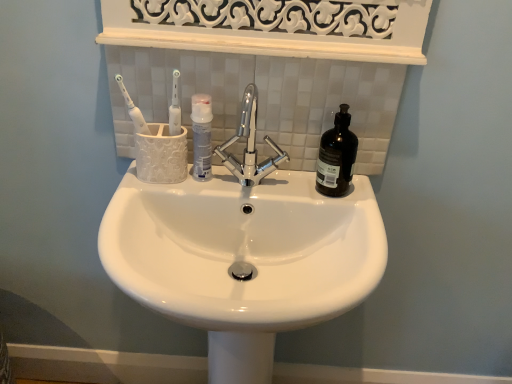
What do you see at coordinates (133, 109) in the screenshot? I see `white glossy toothbrush at upper left` at bounding box center [133, 109].

The width and height of the screenshot is (512, 384). What do you see at coordinates (336, 156) in the screenshot?
I see `black glass bottle at right, arranged as the second mouthwash when viewed from the left` at bounding box center [336, 156].

What is the approximate width of black glass bottle at right, arranged as the second mouthwash when viewed from the left?

9.55 centimeters.

What do you see at coordinates (202, 136) in the screenshot? Image resolution: width=512 pixels, height=384 pixels. I see `white matte mouthwash at center, which is the first mouthwash in left-to-right order` at bounding box center [202, 136].

The image size is (512, 384). In order to click on chrome metallic faucet at center in this screenshot , I will do `click(250, 145)`.

The image size is (512, 384). I want to click on white glossy toothbrush at upper left, so click(x=133, y=109).

Is white matte mouthwash at center, which is the first mouthwash in left-to-right order, positioned far away from white glossy toothbrush at upper left?

No, white matte mouthwash at center, which is the first mouthwash in left-to-right order, is not far from white glossy toothbrush at upper left.

Is white matte mouthwash at center, acting as the 2th mouthwash starting from the right, facing towards white glossy toothbrush at upper left?

No, white matte mouthwash at center, acting as the 2th mouthwash starting from the right, is not oriented towards white glossy toothbrush at upper left.

How many degrees apart are the facing directions of white matte mouthwash at center, acting as the 2th mouthwash starting from the right, and white glossy toothbrush at upper left?

white matte mouthwash at center, acting as the 2th mouthwash starting from the right, and white glossy toothbrush at upper left are facing 12 degrees away from each other.

Visually, is white matte mouthwash at center, which is the first mouthwash in left-to-right order, positioned to the left or to the right of white glossy toothbrush at upper left?

From the image, it's evident that white matte mouthwash at center, which is the first mouthwash in left-to-right order, is to the right of white glossy toothbrush at upper left.

Where is `toothbrush behind the chrome metallic faucet at center`? toothbrush behind the chrome metallic faucet at center is located at coordinates (133, 109).

Is chrome metallic faucet at center touching white glossy toothbrush at upper left?

No, chrome metallic faucet at center is not in contact with white glossy toothbrush at upper left.

From the image's perspective, is chrome metallic faucet at center located beneath white glossy toothbrush at upper left?

Correct, chrome metallic faucet at center appears lower than white glossy toothbrush at upper left in the image.

Considering the sizes of objects chrome metallic faucet at center and white glossy toothbrush at upper left in the image provided, who is shorter, chrome metallic faucet at center or white glossy toothbrush at upper left?

white glossy toothbrush at upper left.

Is point (247, 140) positioned before point (194, 160)?

That is True.

In terms of width, does chrome metallic faucet at center look wider or thinner when compared to white matte mouthwash at center, acting as the 2th mouthwash starting from the right?

chrome metallic faucet at center is wider than white matte mouthwash at center, acting as the 2th mouthwash starting from the right.

Does chrome metallic faucet at center lie behind white matte mouthwash at center, which is the first mouthwash in left-to-right order?

No, chrome metallic faucet at center is closer to the camera.

The width and height of the screenshot is (512, 384). I want to click on tap lying on the right of white matte mouthwash at center, acting as the 2th mouthwash starting from the right, so click(250, 145).

Is white glossy toothbrush at upper left facing towards white matte mouthwash at center, which is the first mouthwash in left-to-right order?

No, white glossy toothbrush at upper left is not oriented towards white matte mouthwash at center, which is the first mouthwash in left-to-right order.

From a real-world perspective, is white glossy toothbrush at upper left over white matte mouthwash at center, acting as the 2th mouthwash starting from the right?

Yes, from a real-world perspective, white glossy toothbrush at upper left is on top of white matte mouthwash at center, acting as the 2th mouthwash starting from the right.

Is white glossy toothbrush at upper left positioned in front of white matte mouthwash at center, acting as the 2th mouthwash starting from the right?

Yes, it is in front of white matte mouthwash at center, acting as the 2th mouthwash starting from the right.

Which is closer, [132,118] or [191,118]?

The point [191,118] is more forward.

Does white glossy sink at center have a larger size compared to white matte mouthwash at center, which is the first mouthwash in left-to-right order?

Correct, white glossy sink at center is larger in size than white matte mouthwash at center, which is the first mouthwash in left-to-right order.

Based on the photo, what's the angular difference between white glossy sink at center and white matte mouthwash at center, acting as the 2th mouthwash starting from the right,'s facing directions?

white glossy sink at center and white matte mouthwash at center, acting as the 2th mouthwash starting from the right, are facing 1.68 degrees away from each other.

Are white glossy sink at center and white matte mouthwash at center, which is the first mouthwash in left-to-right order, located far from each other?

No, there isn't a large distance between white glossy sink at center and white matte mouthwash at center, which is the first mouthwash in left-to-right order.

Which is in front, white glossy sink at center or white matte mouthwash at center, acting as the 2th mouthwash starting from the right?

Positioned in front is white glossy sink at center.

Does point (346, 264) come farther from viewer compared to point (340, 162)?

No, it is in front of (340, 162).

Can you confirm if white glossy sink at center is bigger than black glass bottle at right, which ranks as the first mouthwash in right-to-left order?

Correct, white glossy sink at center is larger in size than black glass bottle at right, which ranks as the first mouthwash in right-to-left order.

Can you see white glossy sink at center touching black glass bottle at right, which ranks as the first mouthwash in right-to-left order?

No.

Between white glossy sink at center and black glass bottle at right, which ranks as the first mouthwash in right-to-left order, which one has less height?

black glass bottle at right, which ranks as the first mouthwash in right-to-left order, is shorter.

From a real-world perspective, is white glossy toothbrush at upper left positioned over black glass bottle at right, arranged as the second mouthwash when viewed from the left, based on gravity?

Yes, from a real-world perspective, white glossy toothbrush at upper left is on top of black glass bottle at right, arranged as the second mouthwash when viewed from the left.

Considering the relative positions of white glossy toothbrush at upper left and black glass bottle at right, which ranks as the first mouthwash in right-to-left order, in the image provided, is white glossy toothbrush at upper left to the left or to the right of black glass bottle at right, which ranks as the first mouthwash in right-to-left order,?

white glossy toothbrush at upper left is to the left of black glass bottle at right, which ranks as the first mouthwash in right-to-left order.

Can we say white glossy toothbrush at upper left lies outside black glass bottle at right, arranged as the second mouthwash when viewed from the left?

Yes, white glossy toothbrush at upper left is outside of black glass bottle at right, arranged as the second mouthwash when viewed from the left.

From the image's perspective, which object appears higher, white glossy toothbrush at upper left or black glass bottle at right, arranged as the second mouthwash when viewed from the left?

white glossy toothbrush at upper left.

Locate an element on the screen. Image resolution: width=512 pixels, height=384 pixels. toothbrush lying in front of the white matte mouthwash at center, which is the first mouthwash in left-to-right order is located at coordinates (133, 109).

Locate an element on the screen. toothbrush on the left of the chrome metallic faucet at center is located at coordinates (133, 109).

Looking at the image, which one is located further to white matte mouthwash at center, which is the first mouthwash in left-to-right order, chrome metallic faucet at center or black glass bottle at right, which ranks as the first mouthwash in right-to-left order?

The object further to white matte mouthwash at center, which is the first mouthwash in left-to-right order, is black glass bottle at right, which ranks as the first mouthwash in right-to-left order.

Looking at the image, which one is located further to white glossy toothbrush at upper left, white glossy sink at center or chrome metallic faucet at center?

white glossy sink at center lies further to white glossy toothbrush at upper left than the other object.

Which object lies nearer to the anchor point white matte mouthwash at center, acting as the 2th mouthwash starting from the right, white glossy toothbrush at upper left or chrome metallic faucet at center?

chrome metallic faucet at center is positioned closer to the anchor white matte mouthwash at center, acting as the 2th mouthwash starting from the right.

When comparing their distances from chrome metallic faucet at center, does white matte mouthwash at center, which is the first mouthwash in left-to-right order, or black glass bottle at right, which ranks as the first mouthwash in right-to-left order, seem closer?

→ white matte mouthwash at center, which is the first mouthwash in left-to-right order, is closer to chrome metallic faucet at center.

From the image, which object appears to be nearer to white matte mouthwash at center, acting as the 2th mouthwash starting from the right, black glass bottle at right, arranged as the second mouthwash when viewed from the left, or chrome metallic faucet at center?

Among the two, chrome metallic faucet at center is located nearer to white matte mouthwash at center, acting as the 2th mouthwash starting from the right.

Looking at the image, which one is located further to chrome metallic faucet at center, black glass bottle at right, which ranks as the first mouthwash in right-to-left order, or white matte mouthwash at center, acting as the 2th mouthwash starting from the right?

black glass bottle at right, which ranks as the first mouthwash in right-to-left order, is positioned further to the anchor chrome metallic faucet at center.

From the picture: Which object lies nearer to the anchor point chrome metallic faucet at center, black glass bottle at right, arranged as the second mouthwash when viewed from the left, or white glossy toothbrush at upper left?

Among the two, black glass bottle at right, arranged as the second mouthwash when viewed from the left, is located nearer to chrome metallic faucet at center.

When comparing their distances from white glossy toothbrush at upper left, does chrome metallic faucet at center or white glossy sink at center seem closer?

chrome metallic faucet at center lies closer to white glossy toothbrush at upper left than the other object.

At what (x,y) coordinates should I click in order to perform the action: click on mouthwash between white glossy toothbrush at upper left and black glass bottle at right, arranged as the second mouthwash when viewed from the left, in the horizontal direction. Please return your answer as a coordinate pair (x, y). The height and width of the screenshot is (384, 512). Looking at the image, I should click on (202, 136).

Locate an element on the screen. mouthwash between chrome metallic faucet at center and white glossy sink at center from top to bottom is located at coordinates (336, 156).

The image size is (512, 384). I want to click on mouthwash located between white glossy toothbrush at upper left and chrome metallic faucet at center in the left-right direction, so click(x=202, y=136).

Find the location of a particular element. This screenshot has height=384, width=512. tap between white matte mouthwash at center, which is the first mouthwash in left-to-right order, and white glossy sink at center from top to bottom is located at coordinates (250, 145).